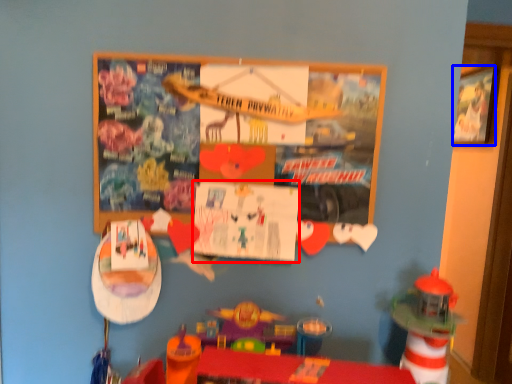
Question: Which object is closer to the camera taking this photo, poster page (highlighted by a red box) or picture frame (highlighted by a blue box)?

Choices:
 (A) poster page
 (B) picture frame

Answer: (A)